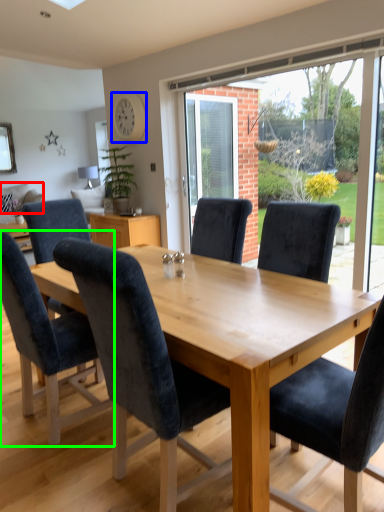
Question: Estimate the real-world distances between objects in this image. Which object is farther from pillow (highlighted by a red box), clock (highlighted by a blue box) or chair (highlighted by a green box)?

Choices:
 (A) clock
 (B) chair

Answer: (B)